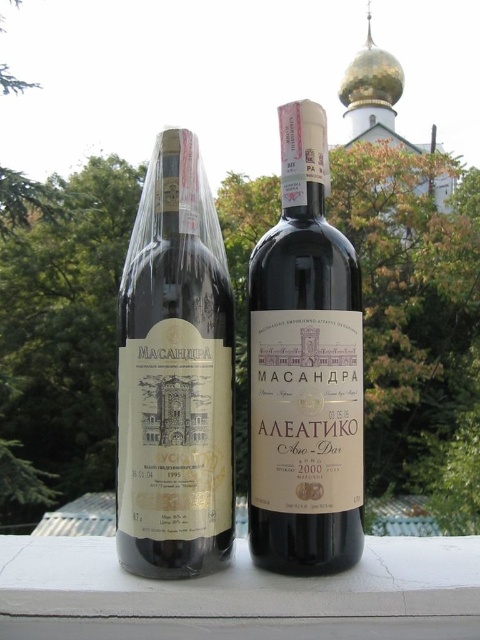
Question: Which of these objects is positioned closest to the matte paper wine bottle at center?

Choices:
 (A) white painted concrete at center
 (B) matte gold foil wine bottle at center

Answer: (B)

Question: Is matte paper wine bottle at center behind white painted concrete at center?

Choices:
 (A) yes
 (B) no

Answer: (A)

Question: Does matte paper wine bottle at center appear on the left side of white painted concrete at center?

Choices:
 (A) no
 (B) yes

Answer: (A)

Question: Which point is closer to the camera taking this photo?

Choices:
 (A) (76, 621)
 (B) (360, 380)

Answer: (A)

Question: Does matte gold foil wine bottle at center lie in front of matte paper wine bottle at center?

Choices:
 (A) yes
 (B) no

Answer: (A)

Question: Among these objects, which one is farthest from the camera?

Choices:
 (A) matte gold foil wine bottle at center
 (B) white painted concrete at center
 (C) matte paper wine bottle at center

Answer: (C)